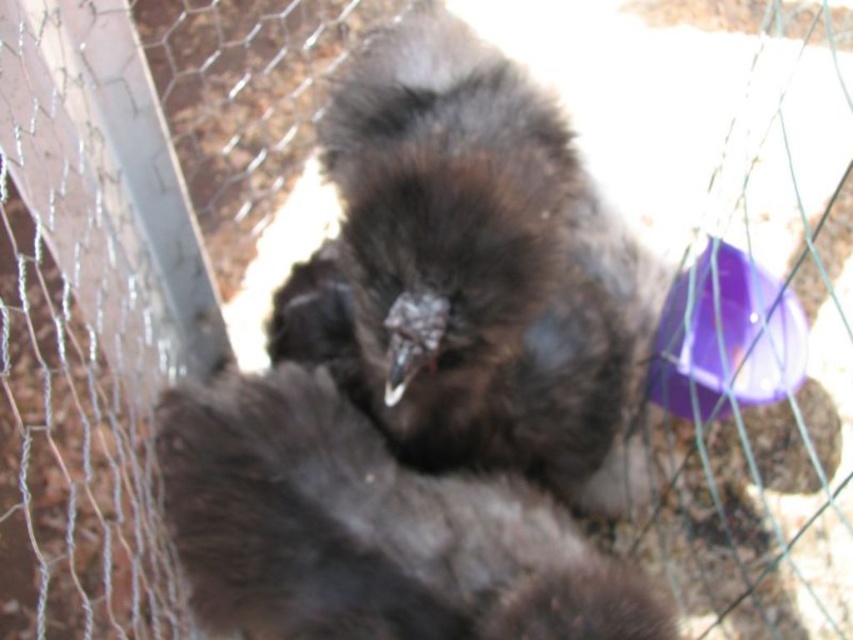
Is dark brown fluffy bird at center closer to camera compared to dark brown feathers at center?

That is False.

Based on the photo, is dark brown fluffy bird at center smaller than dark brown feathers at center?

Actually, dark brown fluffy bird at center might be larger than dark brown feathers at center.

Between point (608, 436) and point (252, 573), which one is positioned in front?

Point (252, 573) is in front.

Locate an element on the screen. dark brown fluffy bird at center is located at coordinates (469, 269).